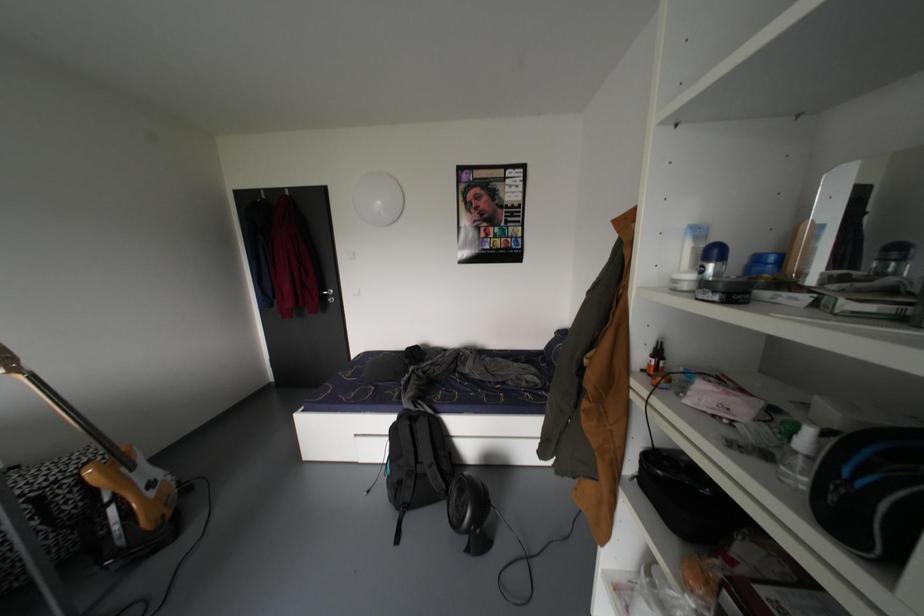
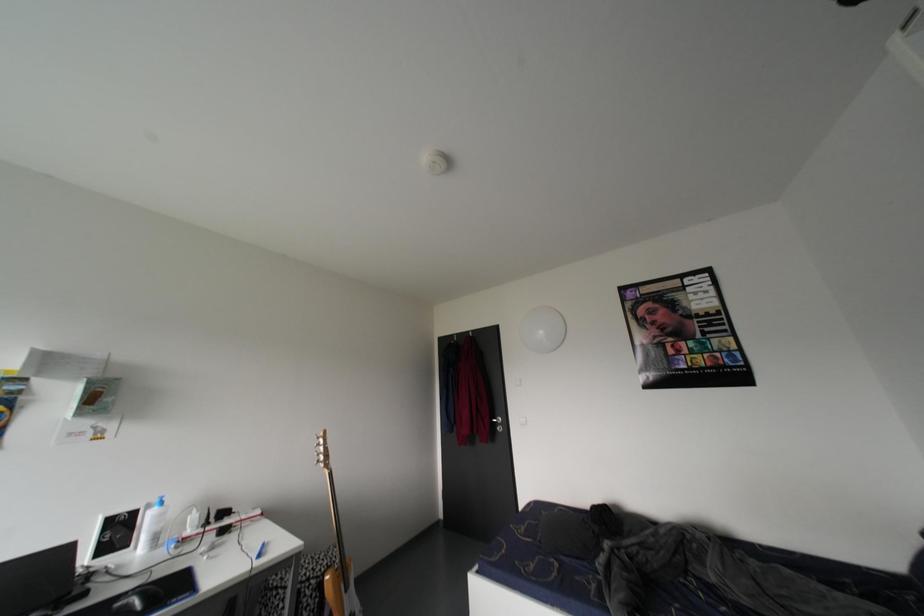
The first image is from the beginning of the video and the second image is from the end. How did the camera likely rotate when shooting the video?

The rotation direction of the camera is left-up.